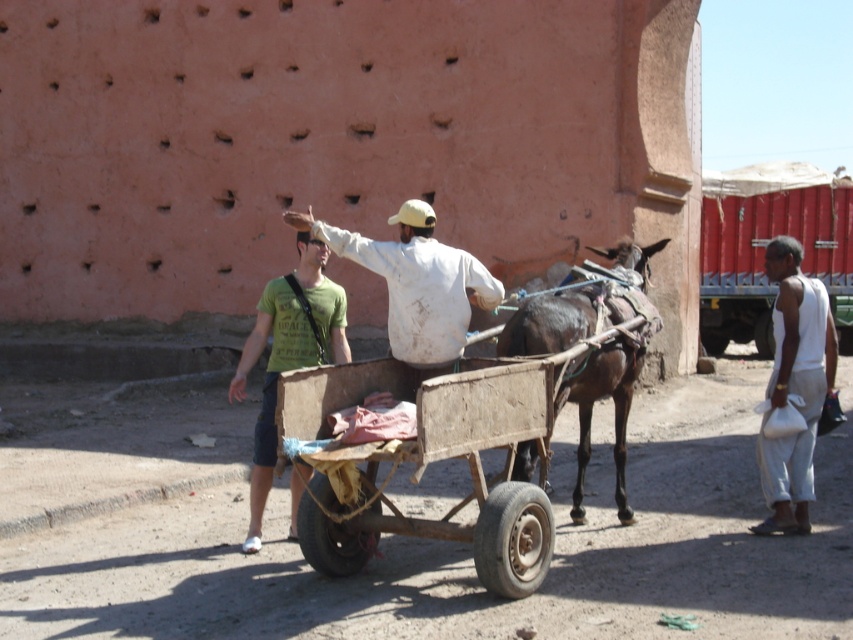
Does dirty white shirt at center have a smaller size compared to white cotton bag at lower right?

Indeed, dirty white shirt at center has a smaller size compared to white cotton bag at lower right.

Which is more to the right, dirty white shirt at center or white cotton bag at lower right?

white cotton bag at lower right

Is point (486, 285) less distant than point (781, 262)?

Yes, point (486, 285) is in front of point (781, 262).

Where is `dirty white shirt at center`? This screenshot has width=853, height=640. dirty white shirt at center is located at coordinates (416, 282).

Can you confirm if brown leather mule at center is shorter than green t-shirt at center?

No, brown leather mule at center is not shorter than green t-shirt at center.

Does brown leather mule at center have a greater width compared to green t-shirt at center?

Correct, the width of brown leather mule at center exceeds that of green t-shirt at center.

This screenshot has width=853, height=640. What do you see at coordinates (575, 307) in the screenshot?
I see `brown leather mule at center` at bounding box center [575, 307].

This screenshot has width=853, height=640. Find the location of `brown leather mule at center`. brown leather mule at center is located at coordinates (575, 307).

Which is more to the left, white cotton bag at lower right or green t-shirt at center?

From the viewer's perspective, green t-shirt at center appears more on the left side.

In the scene shown: Who is taller, white cotton bag at lower right or green t-shirt at center?

white cotton bag at lower right

Where is `white cotton bag at lower right`? The width and height of the screenshot is (853, 640). white cotton bag at lower right is located at coordinates (793, 385).